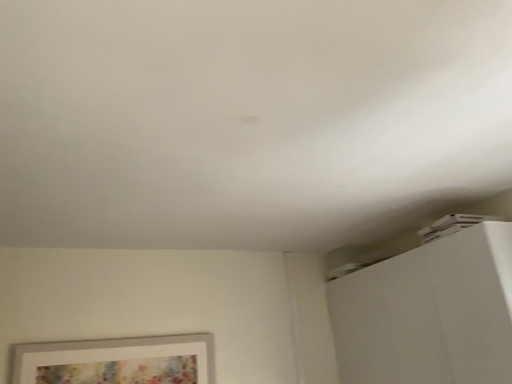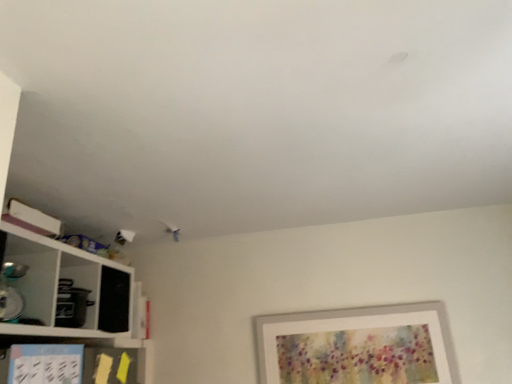
Question: How did the camera likely rotate when shooting the video?

Choices:
 (A) rotated left
 (B) rotated right

Answer: (A)